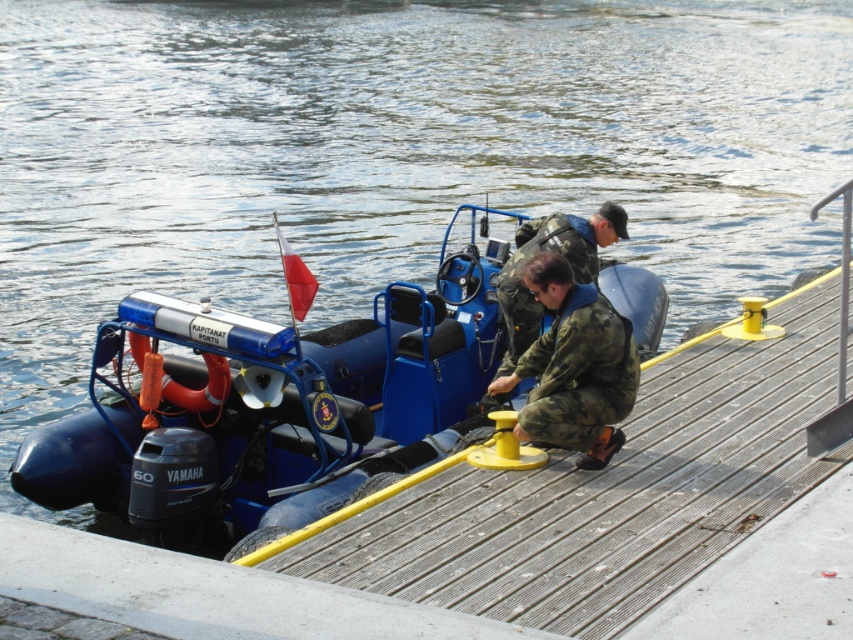
Question: Among these points, which one is farthest from the camera?

Choices:
 (A) (500, 380)
 (B) (346, 385)

Answer: (B)

Question: Does blue rubber boat at center come behind camo fabric uniform at center?

Choices:
 (A) yes
 (B) no

Answer: (B)

Question: Is blue rubber boat at center smaller than camo fabric uniform at center?

Choices:
 (A) yes
 (B) no

Answer: (B)

Question: Considering the relative positions of blue rubber boat at center and camo fabric uniform at center in the image provided, where is blue rubber boat at center located with respect to camo fabric uniform at center?

Choices:
 (A) above
 (B) below

Answer: (B)

Question: Which point is farther from the camera taking this photo?

Choices:
 (A) (524, 365)
 (B) (144, 440)

Answer: (B)

Question: Which point appears closest to the camera in this image?

Choices:
 (A) (x=576, y=435)
 (B) (x=389, y=444)

Answer: (A)